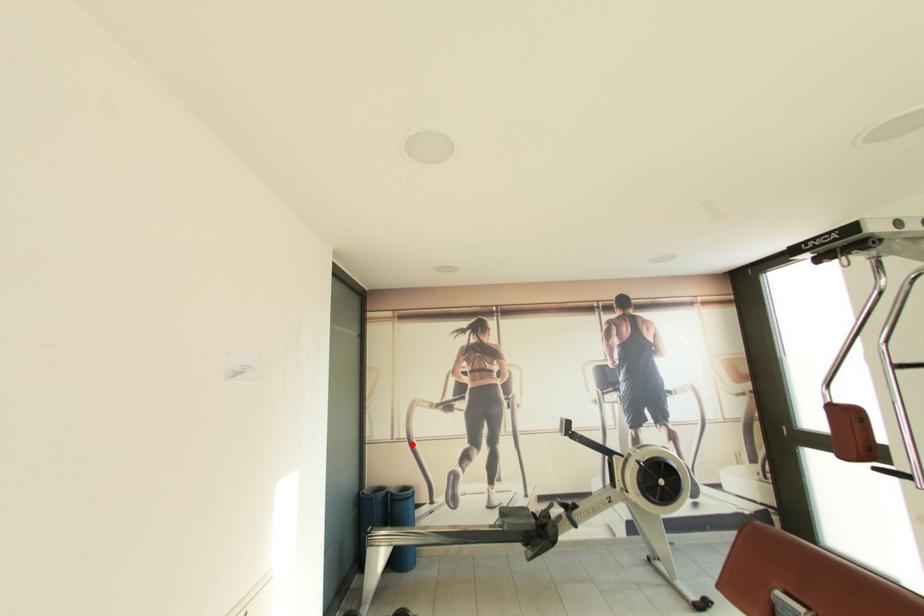
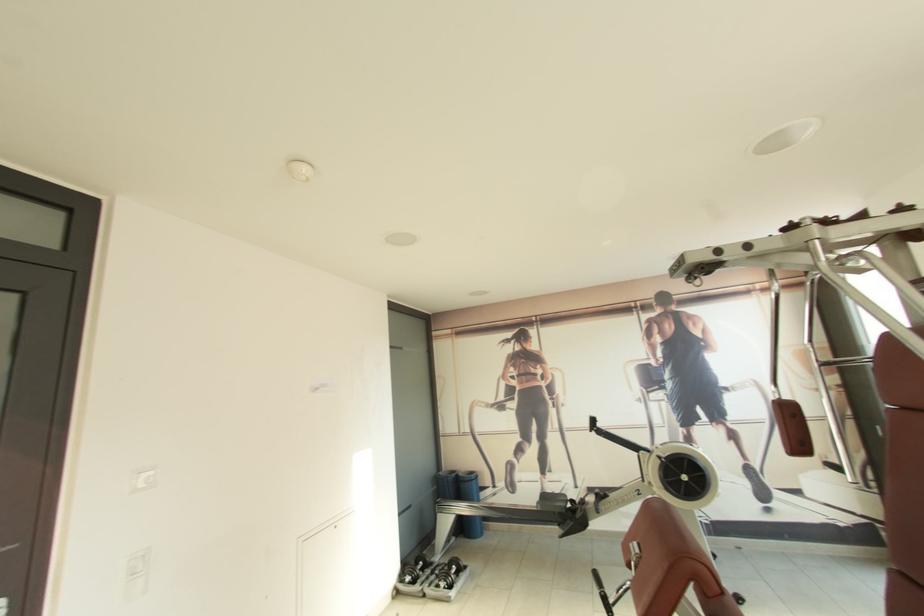
Question: I am providing you with two images of the same scene from different viewpoints. In image1, a red point is highlighted. Considering the same 3D point in image2, which of the following is correct?

Choices:
 (A) It is closer
 (B) It is farther

Answer: (B)